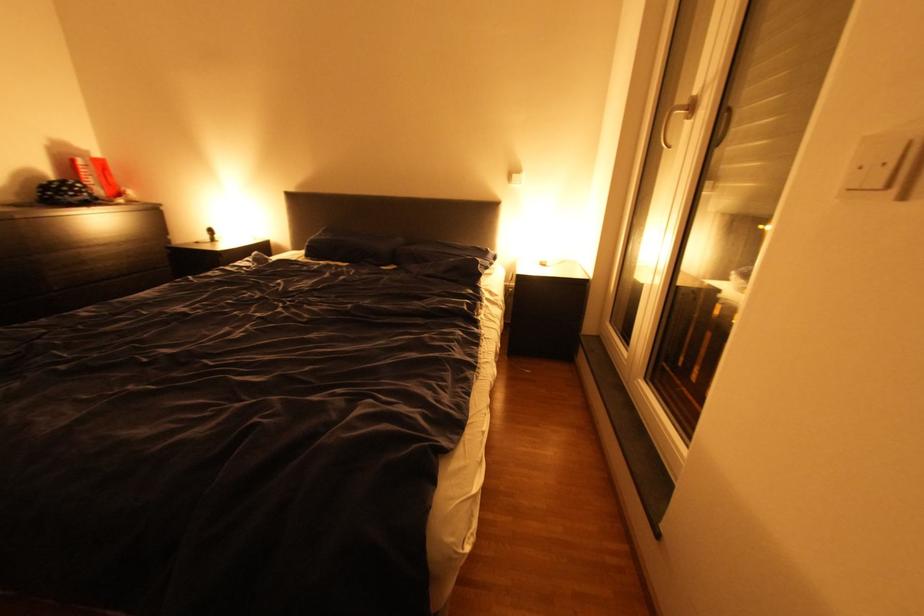
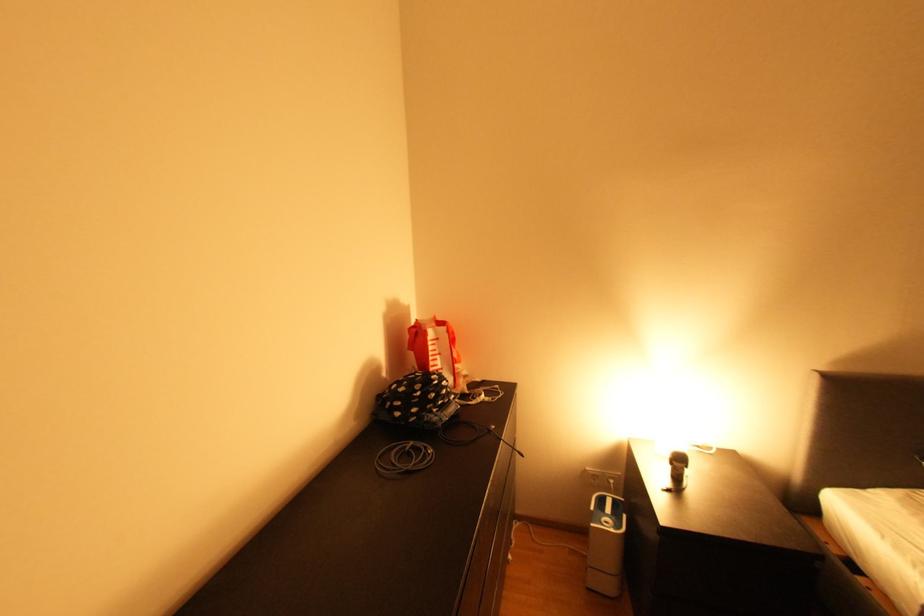
In the second image, find the point that corresponds to point (92, 190) in the first image.

(457, 389)